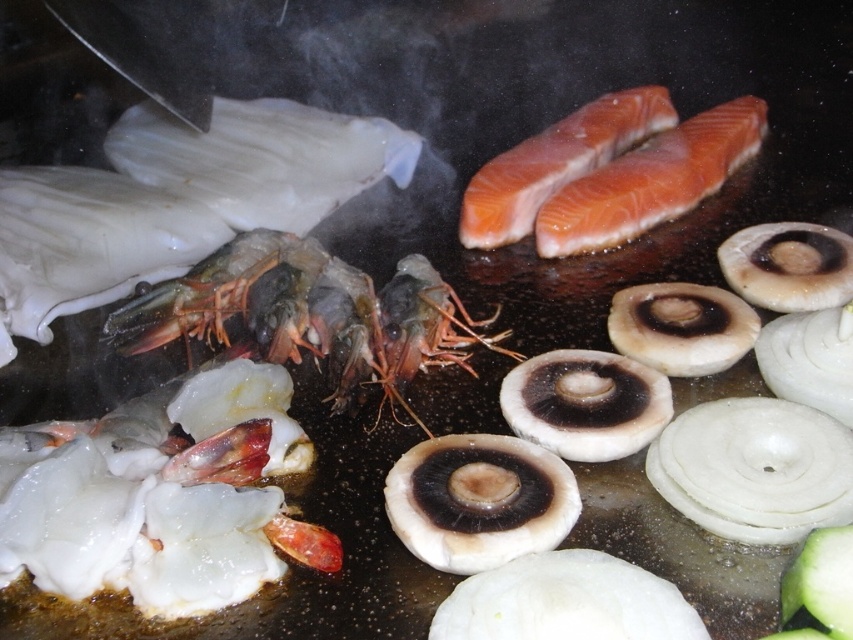
Question: Is translucent white shrimp at lower left to the right of shiny red prawns at center from the viewer's perspective?

Choices:
 (A) no
 (B) yes

Answer: (A)

Question: Which of the following is the closest to the observer?

Choices:
 (A) shiny red prawns at center
 (B) translucent white shrimp at lower left

Answer: (B)

Question: Can you confirm if translucent white shrimp at lower left is wider than shiny red prawns at center?

Choices:
 (A) yes
 (B) no

Answer: (B)

Question: Is translucent white shrimp at lower left smaller than shiny red prawns at center?

Choices:
 (A) no
 (B) yes

Answer: (B)